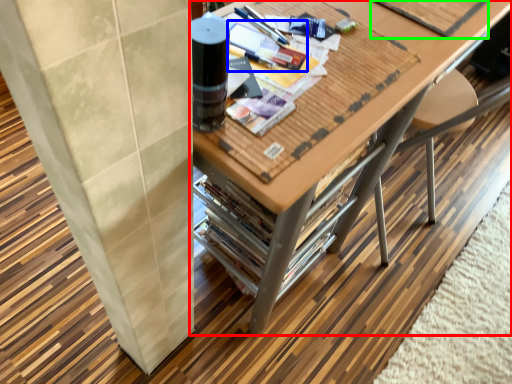
Question: Considering the real-world distances, which object is closest to table (highlighted by a red box)? magazine (highlighted by a blue box) or magazine (highlighted by a green box).

Choices:
 (A) magazine
 (B) magazine

Answer: (B)